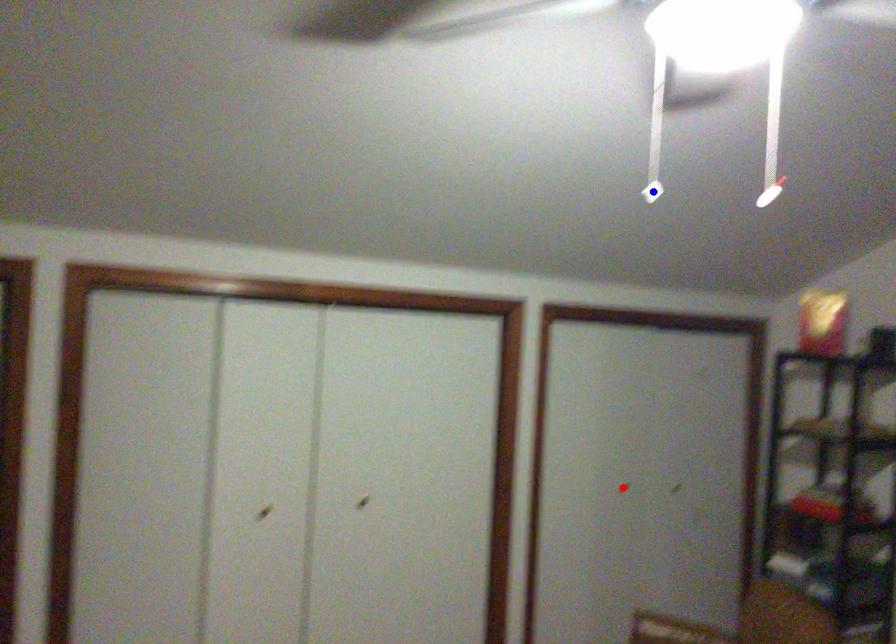
Question: Two points are marked on the image. Which point is closer to the camera?

Choices:
 (A) Blue point is closer.
 (B) Red point is closer.

Answer: (A)